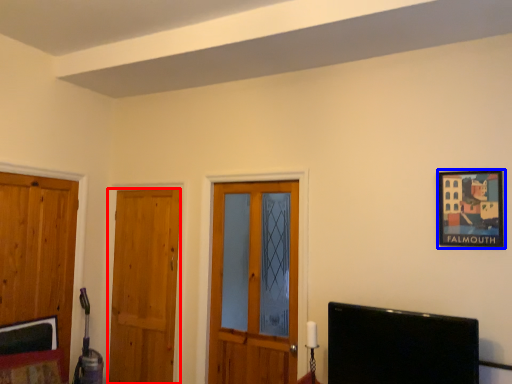
Question: Among these objects, which one is farthest to the camera, door (highlighted by a red box) or picture frame (highlighted by a blue box)?

Choices:
 (A) door
 (B) picture frame

Answer: (A)